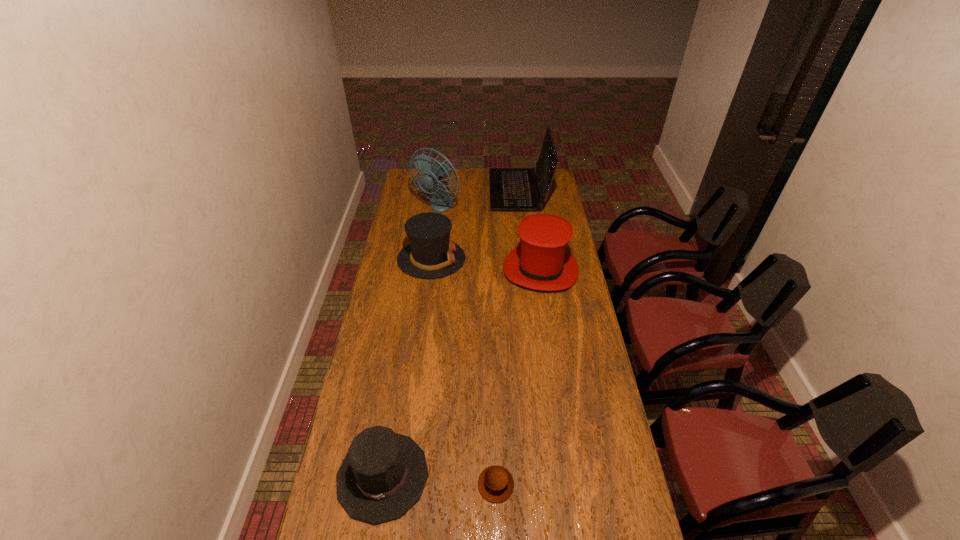
Image resolution: width=960 pixels, height=540 pixels. In order to click on fan in this screenshot , I will do `click(441, 201)`.

This screenshot has height=540, width=960. Identify the location of the second tallest object. (511, 189).

Locate an element on the screen. This screenshot has height=540, width=960. the tallest dress hat is located at coordinates (541, 262).

The image size is (960, 540). I want to click on the fourth shortest object, so click(541, 262).

At what (x,y) coordinates should I click in order to perform the action: click on the second shortest object. Please return your answer as a coordinate pair (x, y). This screenshot has height=540, width=960. Looking at the image, I should click on coord(383,474).

Find the location of a particular element. Image resolution: width=960 pixels, height=540 pixels. the nearest dress hat is located at coordinates (383, 474).

Locate an element on the screen. The height and width of the screenshot is (540, 960). the shortest object is located at coordinates (495, 483).

Locate an element on the screen. vacant space situated 0.090m in front of the fan to blow air is located at coordinates (434, 230).

At what (x,y) coordinates should I click in order to perform the action: click on vacant space situated on the screen of the second tallest object. Please return your answer as a coordinate pair (x, y). The height and width of the screenshot is (540, 960). Looking at the image, I should click on click(429, 191).

Where is `free space located 0.290m on the screen of the second tallest object`? The height and width of the screenshot is (540, 960). free space located 0.290m on the screen of the second tallest object is located at coordinates (440, 191).